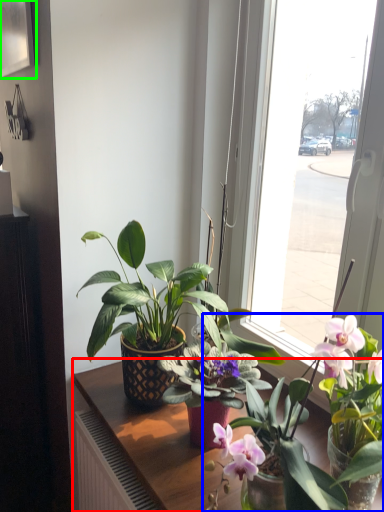
Question: Considering the real-world distances, which object is closest to table (highlighted by a red box)? houseplant (highlighted by a blue box) or picture frame (highlighted by a green box).

Choices:
 (A) houseplant
 (B) picture frame

Answer: (A)